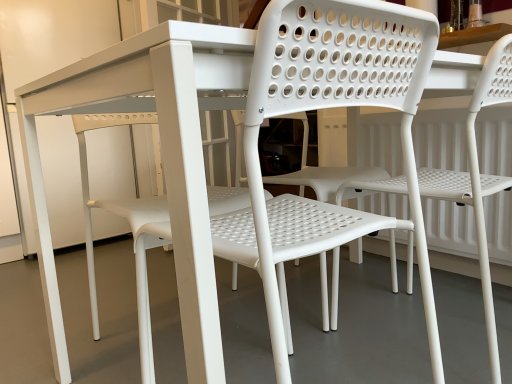
Find the location of `free space underneath white plastic chair at center, the 1th chair positioned from the right (from a real-world perspective)`. free space underneath white plastic chair at center, the 1th chair positioned from the right (from a real-world perspective) is located at coordinates (439, 335).